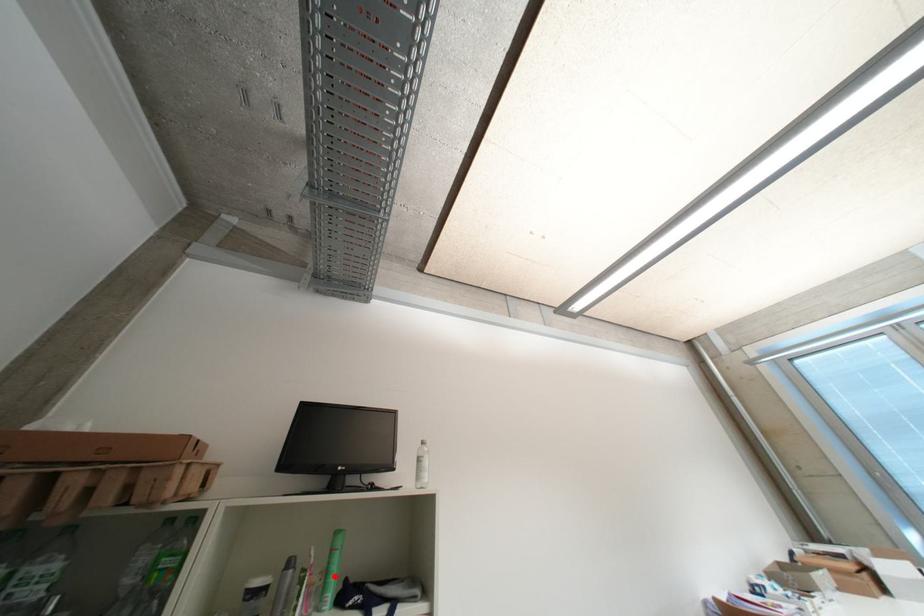
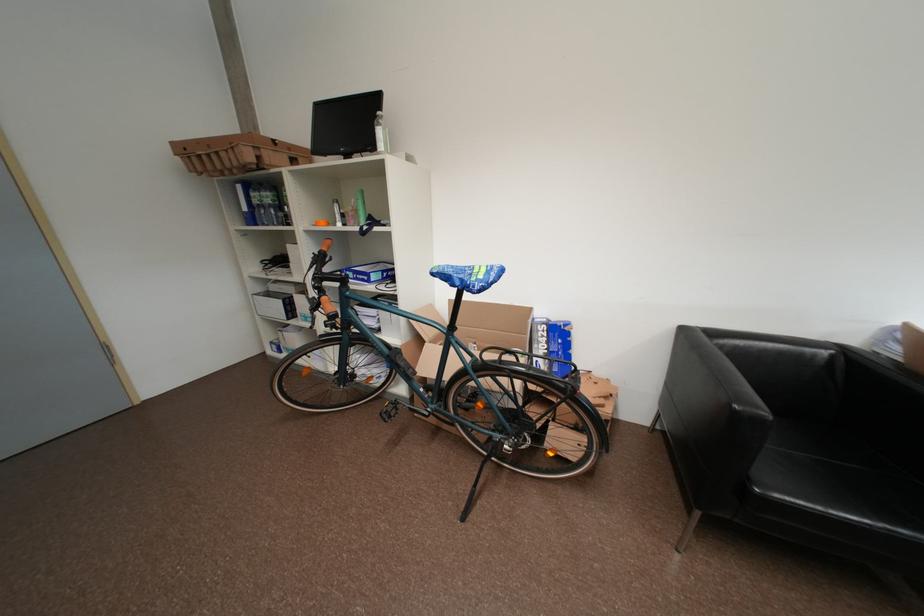
Question: I am providing you with two images of the same scene from different viewpoints. In image1, a red point is highlighted. Considering the same 3D point in image2, which of the following is correct?

Choices:
 (A) It is closer
 (B) It is farther

Answer: (A)